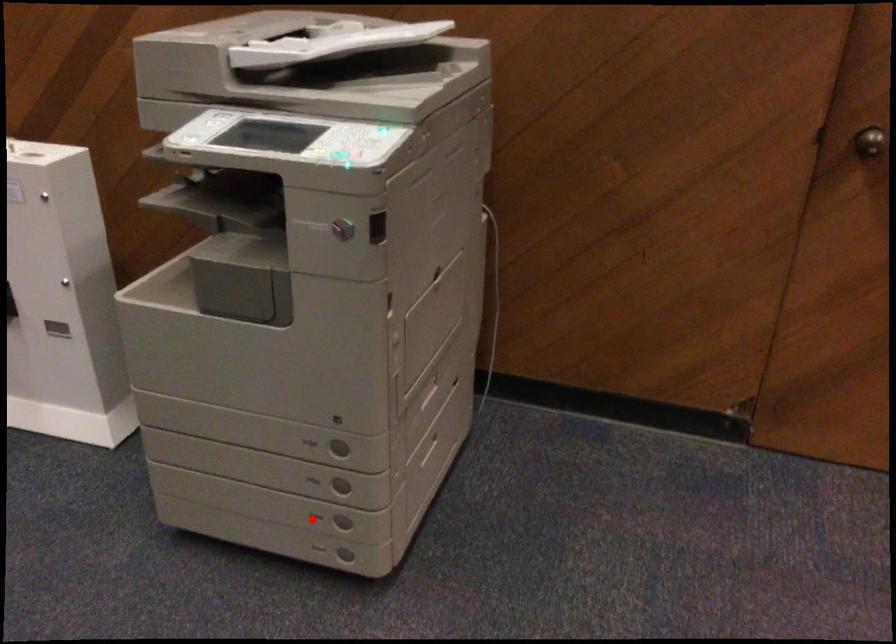
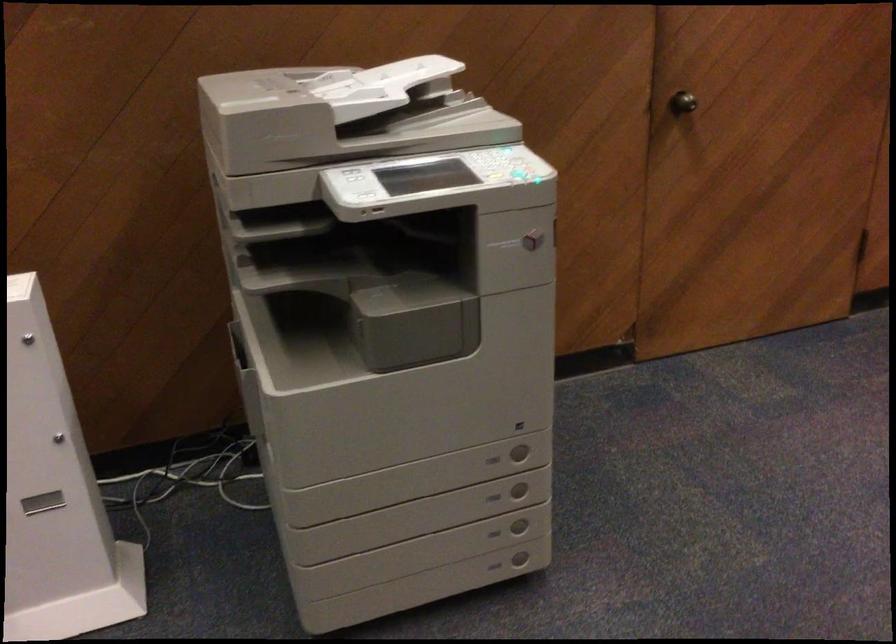
Where in the second image is the point corresponding to the highlighted location from the first image?

(494, 533)